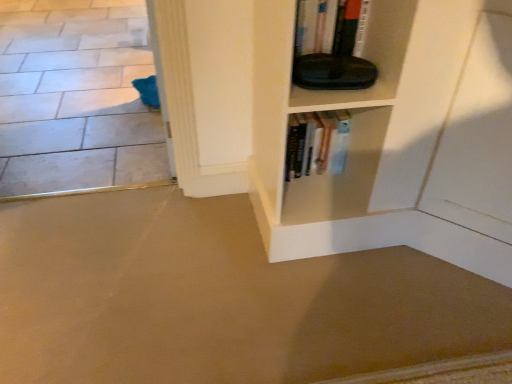
Question: Does beige carpet at lower left, the first concrete when ordered from front to back, have a smaller size compared to hardcover books at center?

Choices:
 (A) no
 (B) yes

Answer: (A)

Question: From a real-world perspective, is beige carpet at lower left, which appears as the 1th concrete when ordered from the bottom, physically above hardcover books at center?

Choices:
 (A) no
 (B) yes

Answer: (A)

Question: Does beige carpet at lower left, the first concrete when ordered from front to back, have a greater width compared to hardcover books at center?

Choices:
 (A) no
 (B) yes

Answer: (B)

Question: Considering the relative sizes of beige carpet at lower left, acting as the 2th concrete starting from the top, and hardcover books at center in the image provided, is beige carpet at lower left, acting as the 2th concrete starting from the top, thinner than hardcover books at center?

Choices:
 (A) yes
 (B) no

Answer: (B)

Question: Considering the relative positions of beige carpet at lower left, the first concrete when ordered from front to back, and hardcover books at center in the image provided, is beige carpet at lower left, the first concrete when ordered from front to back, to the right of hardcover books at center from the viewer's perspective?

Choices:
 (A) yes
 (B) no

Answer: (B)

Question: Is beige carpet at lower left, which appears as the 1th concrete when ordered from the bottom, spatially inside hardcover books at center, or outside of it?

Choices:
 (A) inside
 (B) outside

Answer: (B)

Question: Considering the positions of beige carpet at lower left, which appears as the 1th concrete when ordered from the bottom, and hardcover books at center in the image, is beige carpet at lower left, which appears as the 1th concrete when ordered from the bottom, bigger or smaller than hardcover books at center?

Choices:
 (A) big
 (B) small

Answer: (A)

Question: Considering their positions, is beige carpet at lower left, acting as the 2th concrete starting from the top, located in front of or behind hardcover books at center?

Choices:
 (A) behind
 (B) front

Answer: (B)

Question: From a real-world perspective, is beige carpet at lower left, the first concrete when ordered from front to back, physically located above or below hardcover books at center?

Choices:
 (A) below
 (B) above

Answer: (A)

Question: Is point (121, 329) closer or farther from the camera than point (113, 41)?

Choices:
 (A) farther
 (B) closer

Answer: (B)

Question: Considering the positions of beige carpet at lower left, marked as the second concrete in a back-to-front arrangement, and white tile floor at lower left, which appears as the first concrete when viewed from the back, in the image, is beige carpet at lower left, marked as the second concrete in a back-to-front arrangement, taller or shorter than white tile floor at lower left, which appears as the first concrete when viewed from the back,?

Choices:
 (A) tall
 (B) short

Answer: (B)

Question: Do you think beige carpet at lower left, acting as the 2th concrete starting from the top, is within white tile floor at lower left, which is the second concrete in front-to-back order, or outside of it?

Choices:
 (A) outside
 (B) inside

Answer: (A)

Question: From a real-world perspective, is beige carpet at lower left, which appears as the 1th concrete when ordered from the bottom, positioned above or below white tile floor at lower left, which is the second concrete in bottom-to-top order?

Choices:
 (A) above
 (B) below

Answer: (A)

Question: From their relative heights in the image, would you say white tile floor at lower left, which is the second concrete in bottom-to-top order, is taller or shorter than beige carpet at lower left, the first concrete when ordered from front to back?

Choices:
 (A) short
 (B) tall

Answer: (B)

Question: From the image's perspective, relative to beige carpet at lower left, the first concrete when ordered from front to back, is white tile floor at lower left, which appears as the first concrete when viewed from the back, above or below?

Choices:
 (A) above
 (B) below

Answer: (A)